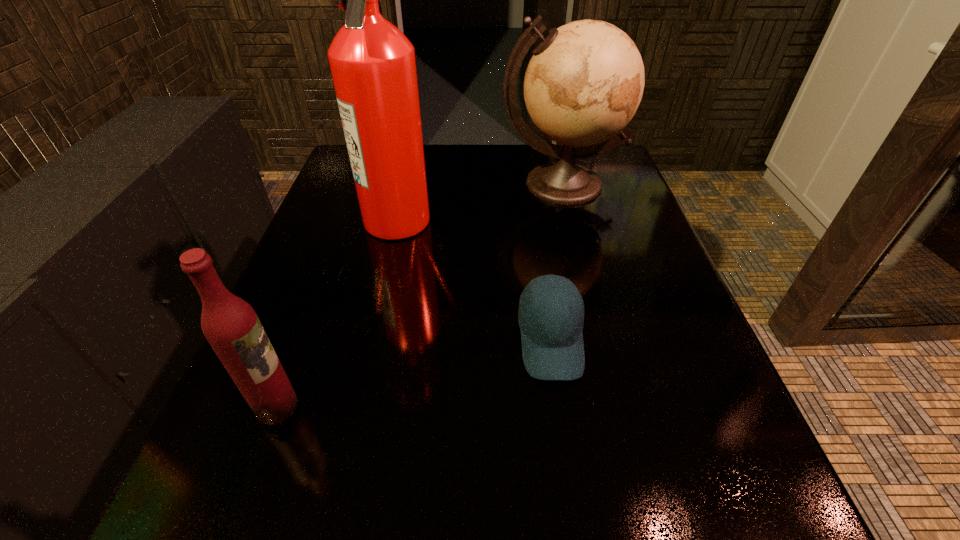
Locate an element on the screen. The image size is (960, 540). free space between the second tallest object and the third tallest object is located at coordinates (420, 295).

At what (x,y) coordinates should I click in order to perform the action: click on vacant area between the baseball cap and the leftmost object. Please return your answer as a coordinate pair (x, y). The height and width of the screenshot is (540, 960). Looking at the image, I should click on (414, 374).

Select which object is the closest to the leftmost object. Please provide its 2D coordinates. Your answer should be formatted as a tuple, i.e. [(x, y)], where the tuple contains the x and y coordinates of a point satisfying the conditions above.

[(552, 337)]

Where is `object that is the second closest to the shortest object`? The width and height of the screenshot is (960, 540). object that is the second closest to the shortest object is located at coordinates (584, 82).

Identify the location of vacant space that satisfies the following two spatial constraints: 1. on the front-facing side of the third farthest object; 2. on the label of the nearest object. (561, 407).

The height and width of the screenshot is (540, 960). I want to click on blank area in the image that satisfies the following two spatial constraints: 1. on the front-facing side of the globe; 2. on the label of the liquor, so click(617, 407).

Locate an element on the screen. free space that satisfies the following two spatial constraints: 1. on the front-facing side of the second tallest object; 2. at the nozzle of the fire extinguisher is located at coordinates (570, 219).

The height and width of the screenshot is (540, 960). What are the coordinates of `vacant area that satisfies the following two spatial constraints: 1. on the front-facing side of the shortest object; 2. on the label of the nearest object` in the screenshot? It's located at (561, 407).

Identify the location of free space that satisfies the following two spatial constraints: 1. on the front-facing side of the globe; 2. at the nozzle of the tallest object. The image size is (960, 540). (570, 219).

At what (x,y) coordinates should I click in order to perform the action: click on free space that satisfies the following two spatial constraints: 1. on the front-facing side of the second tallest object; 2. on the label of the leftmost object. Please return your answer as a coordinate pair (x, y). Looking at the image, I should click on pyautogui.click(x=617, y=407).